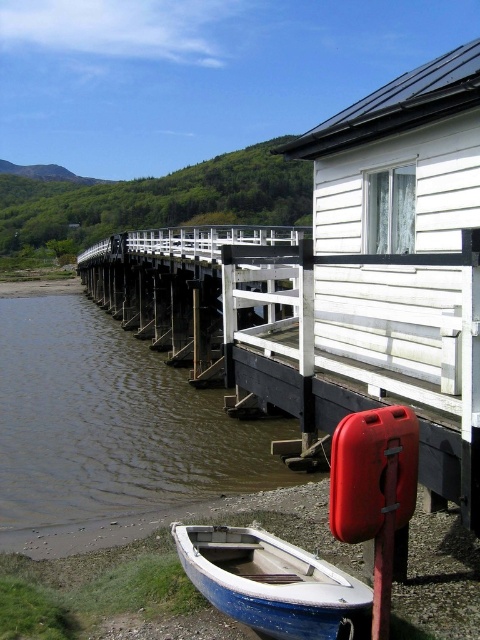
Question: Among these objects, which one is farthest from the camera?

Choices:
 (A) blue painted wood boat at lower left
 (B) white wooden rail at center

Answer: (B)

Question: Does brown murky water at lower left appear under blue painted wood boat at lower left?

Choices:
 (A) yes
 (B) no

Answer: (B)

Question: Is brown murky water at lower left closer to camera compared to blue painted wood boat at lower left?

Choices:
 (A) no
 (B) yes

Answer: (A)

Question: Which point is closer to the camera taking this photo?

Choices:
 (A) (71, 496)
 (B) (212, 288)
 (C) (286, 620)

Answer: (C)

Question: Can you confirm if brown murky water at lower left is positioned above blue painted wood boat at lower left?

Choices:
 (A) no
 (B) yes

Answer: (B)

Question: Which point appears farthest from the camera in this image?

Choices:
 (A) pos(140,316)
 (B) pos(328,605)
 (C) pos(50,436)

Answer: (A)